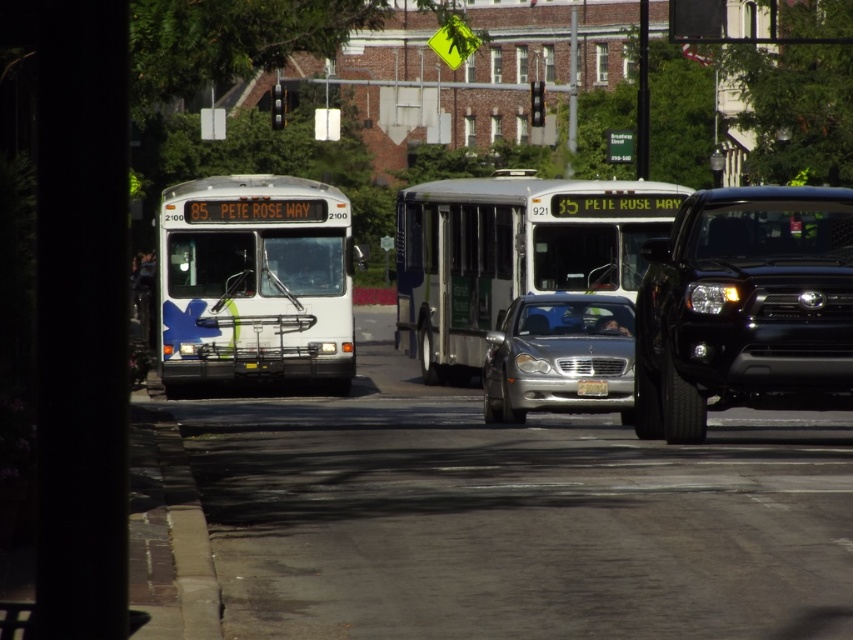
Question: Which point is farther to the camera?

Choices:
 (A) (809, 237)
 (B) (218, 289)

Answer: (B)

Question: Does black matte truck at right have a larger size compared to white metallic bus at center?

Choices:
 (A) no
 (B) yes

Answer: (A)

Question: Does black matte truck at right lie behind white metallic bus at center?

Choices:
 (A) no
 (B) yes

Answer: (A)

Question: Which of the following is the farthest from the observer?

Choices:
 (A) (408, 192)
 (B) (602, 385)
 (C) (744, 342)

Answer: (A)

Question: Among these objects, which one is farthest from the camera?

Choices:
 (A) silver metallic sedan at center
 (B) white matte bus at center
 (C) black matte truck at right
 (D) yellow matte license plate at center

Answer: (B)

Question: Is black matte truck at right positioned behind white matte bus at center?

Choices:
 (A) yes
 (B) no

Answer: (B)